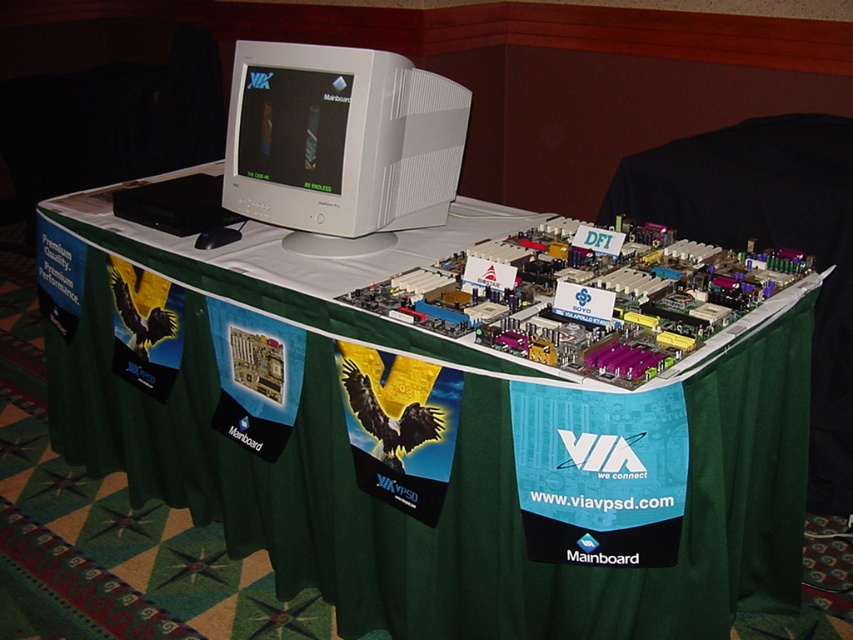
You are setting up a booth at a trade show and need to place a promotional banner between the green fabric table at center and the white plastic monitor at upper center. Based on their positions, where should you place the banner so it is between them?

The green fabric table at center is to the right of the white plastic monitor at upper center, so you should place the banner to the left of the green fabric table at center and to the right of the white plastic monitor at upper center to position it between them.

You are setting up for an event and need to place a 10cm tall decorative item on either the green fabric table at center or the white plastic monitor at upper center. Based on their heights, which surface can safely accommodate the item without it exceeding the height of the other object?

The green fabric table at center has a greater height compared to the white plastic monitor at upper center. Therefore, placing the decorative item on the green fabric table at center ensures it won not exceed the height of the white plastic monitor at upper center.

Consider the image. You are at the exhibition and want to take a photo of the motherboard located at point (532, 531) and the other at point (265, 177). Which motherboard should you focus on first to ensure it appears clearer in your photo?

You should focus on the motherboard at point (532, 531) first because it is closer to the camera and will appear clearer in the photo than the one at point (265, 177).